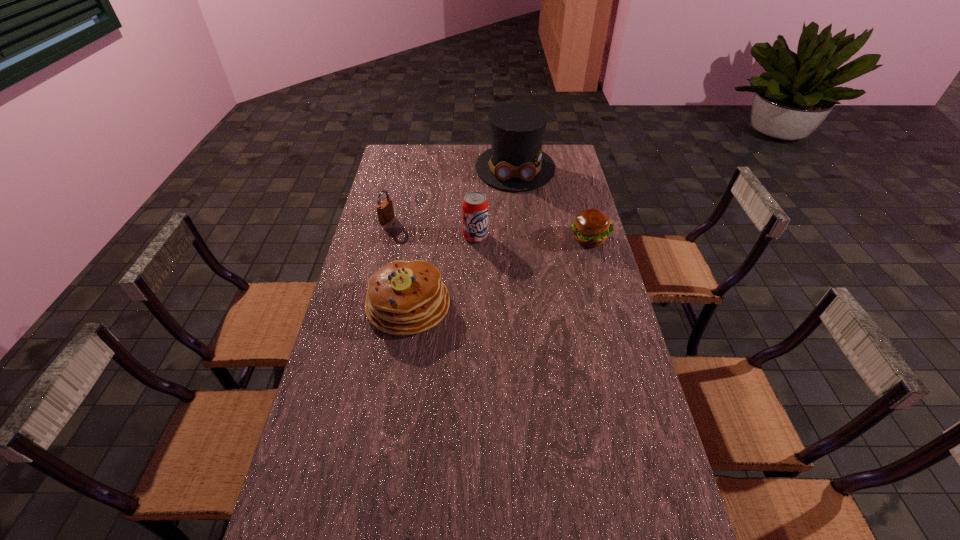
What are the coordinates of `free space on the desktop that is between the pancake and the shortest object and is positioned with goggles on the front of the farthest object` in the screenshot? It's located at (519, 264).

This screenshot has height=540, width=960. Identify the location of free space on the desktop that is between the pancake and the hamburger and is positioned on the surface of the fourth shortest object. (500, 272).

Locate an element on the screen. This screenshot has height=540, width=960. free space on the desktop that is between the pancake and the hamburger and is positioned on the front-facing side of the padlock is located at coordinates (517, 265).